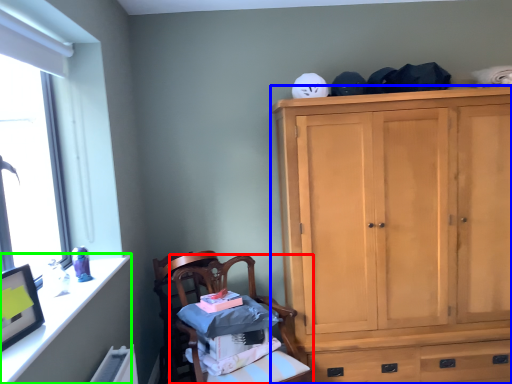
Question: Which object is positioned farthest from chair (highlighted by a red box)? Select from cabinetry (highlighted by a blue box) and vanity (highlighted by a green box).

Choices:
 (A) cabinetry
 (B) vanity

Answer: (A)